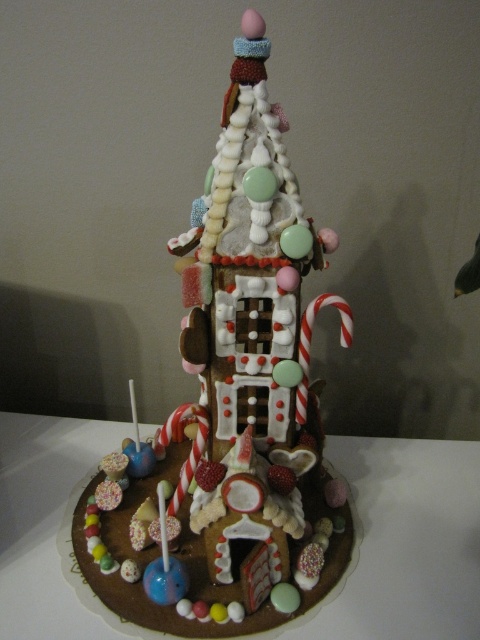
You are standing in front of a gingerbread house and see a point marked at coordinates (x=230, y=410). According to the image, what object is located at that point?

The point at coordinates (x=230, y=410) corresponds to the chocolate candy house at center.

You are a visitor at a bakery and see both the chocolate candy house at center and the chocolate cake at center. Which one is located higher up in the image?

The chocolate candy house at center is located higher up in the image than the chocolate cake at center because it is positioned above it.

You are standing in a candy store and see the chocolate candy house at center. If you want to place a new candy decoration 30 inches away from the house, where should you place it?

The chocolate candy house at center is 29.30 inches away from the viewer. To place a new candy decoration 30 inches away from the house, you should place it slightly behind your current position since the house is already 29.30 inches in front of you.